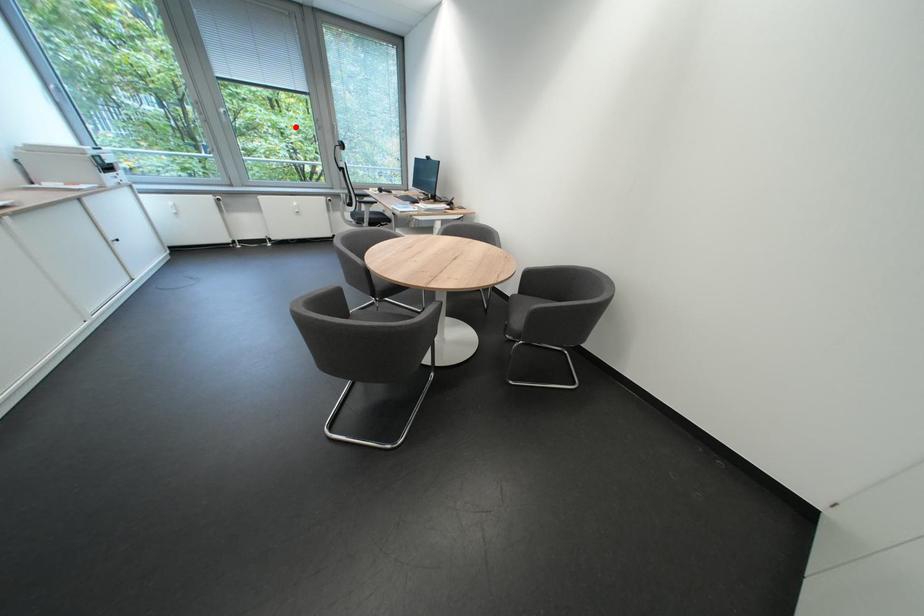
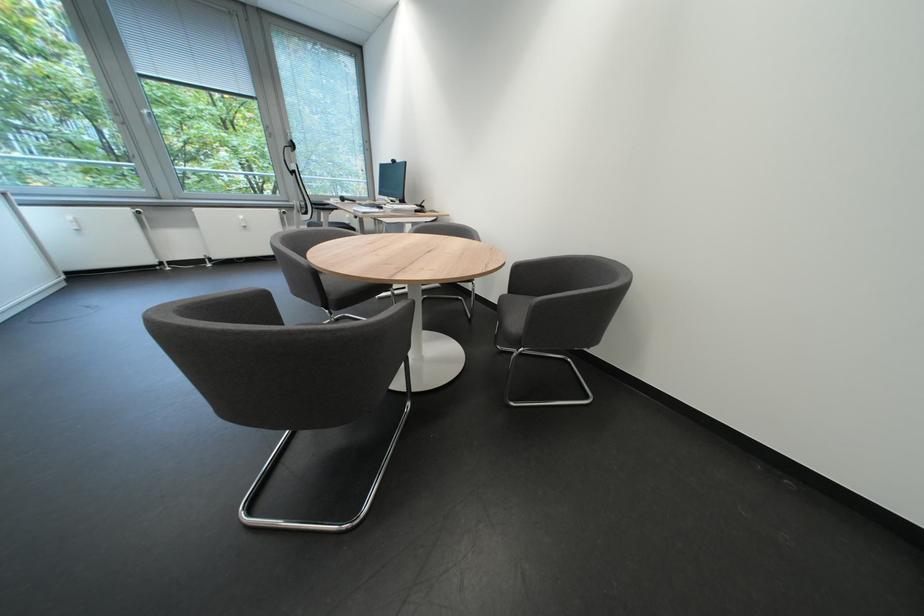
Find the pixel in the second image that matches the highlighted location in the first image.

(248, 146)